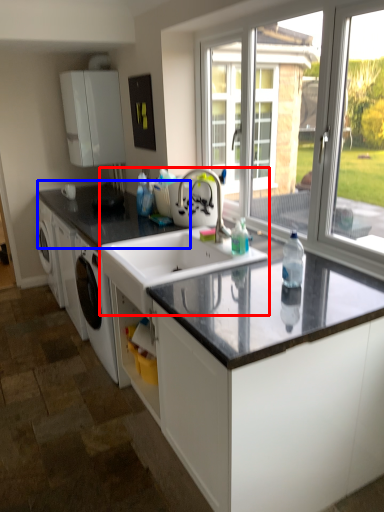
Question: Which object appears farthest to the camera in this image, sink (highlighted by a red box) or countertop (highlighted by a blue box)?

Choices:
 (A) sink
 (B) countertop

Answer: (B)